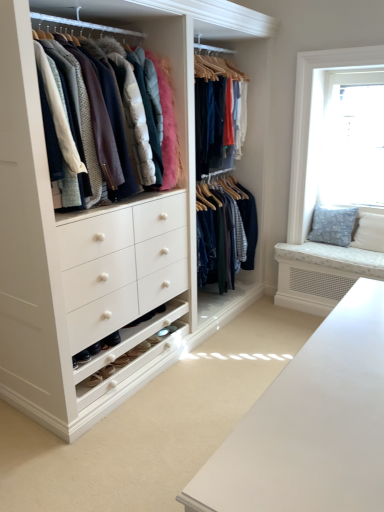
Question: Looking at the image, does matte white coat rack at upper left seem bigger or smaller compared to transparent glass window at upper right?

Choices:
 (A) big
 (B) small

Answer: (A)

Question: Would you say matte white coat rack at upper left is to the left or to the right of transparent glass window at upper right in the picture?

Choices:
 (A) right
 (B) left

Answer: (B)

Question: Estimate the real-world distances between objects in this image. Which object is closer to the blue textured cushion at right?

Choices:
 (A) matte white coat rack at upper left
 (B) transparent glass window at upper right

Answer: (B)

Question: Which is farther from the matte white coat rack at upper left?

Choices:
 (A) transparent glass window at upper right
 (B) blue textured cushion at right

Answer: (B)